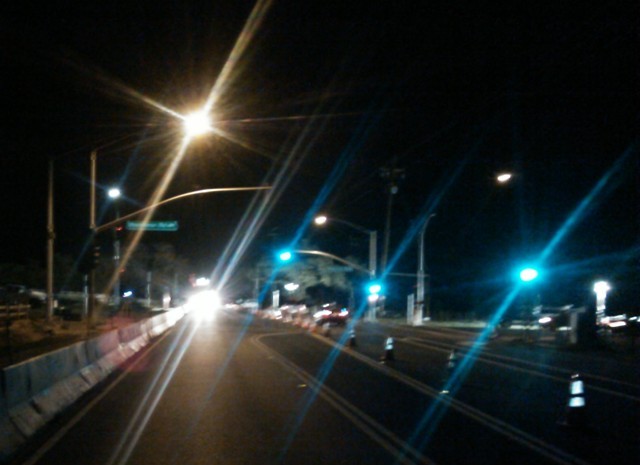
Find the location of `bright white light`. bright white light is located at coordinates (112, 192), (205, 298).